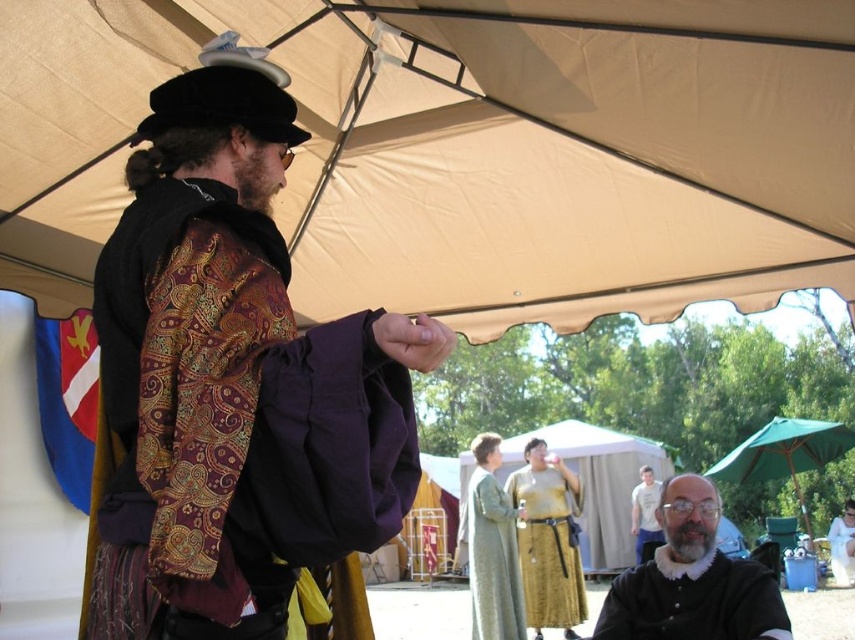
Consider the image. You are a guest at the Renaissance fair and want to take a photo of the light gray cotton shirt at center without the golden fabric tent at center blocking the view. Is this possible?

The light gray cotton shirt at center is behind the golden fabric tent at center, so it is already blocked by the tent. Therefore, you cannot take a photo of the light gray cotton shirt at center without the golden fabric tent at center blocking the view.

You are standing at the Renaissance fair and want to determine which of the two points, point (629,561) or point (652,534), is closer to you. Which point is nearer?

Point (629,561) is closer to you because it is further to the viewer than point (652,534).

You are a visitor at the Renaissance fair and want to find shade. You see the beige canvas canopy at upper center and the green fabric umbrella at lower right. Which one is higher above the ground?

The beige canvas canopy at upper center is located above the green fabric umbrella at lower right, so it is higher.